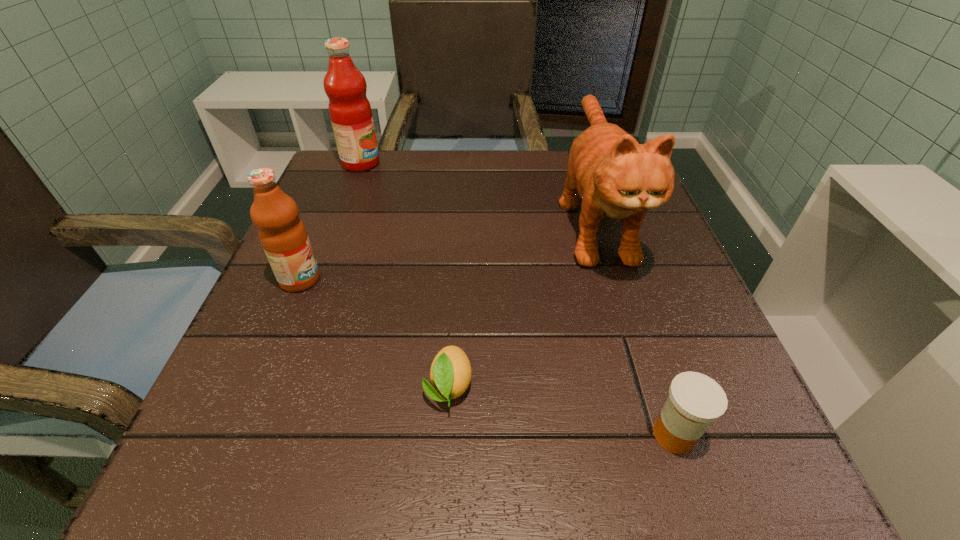
The height and width of the screenshot is (540, 960). Identify the location of the farther fruit juice. (350, 112).

This screenshot has height=540, width=960. What are the coordinates of `cat` in the screenshot? It's located at (615, 176).

At what (x,y) coordinates should I click in order to perform the action: click on the shorter fruit juice. Please return your answer as a coordinate pair (x, y). This screenshot has width=960, height=540. Looking at the image, I should click on (283, 236).

I want to click on the nearer fruit juice, so click(283, 236).

In order to click on medicine in this screenshot , I will do `click(695, 400)`.

Where is `the third object from right to left`? The width and height of the screenshot is (960, 540). the third object from right to left is located at coordinates (450, 374).

Image resolution: width=960 pixels, height=540 pixels. I want to click on the shortest object, so click(450, 374).

Find the location of `vacant area located 0.060m on the front label of the taller fruit juice`. vacant area located 0.060m on the front label of the taller fruit juice is located at coordinates (404, 163).

Identify the location of free space located on the face of the cat. (655, 411).

This screenshot has height=540, width=960. I want to click on blank space located on the front label of the third tallest object, so click(523, 279).